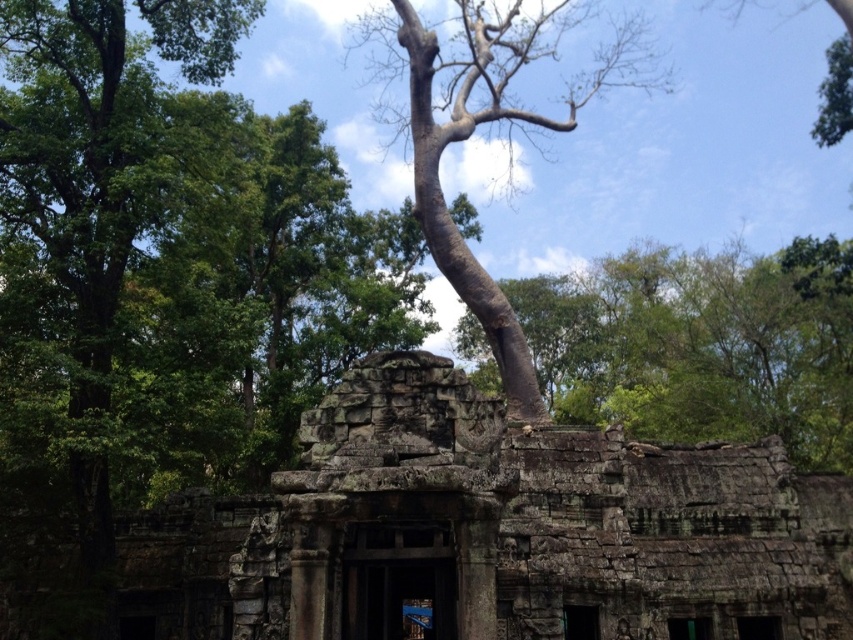
You are an archaeologist examining the ancient site. You notice the weathered stone ruins at center and the bark textured tree at center. Which structure is wider when comparing their widths?

The bark textured tree at center is wider than the weathered stone ruins at center.

You are an archaeologist examining the ancient stone structure. You notice two trees in the scene. Which tree, the brown rough tree trunk at center or the bark textured tree at center, is closer to you?

The brown rough tree trunk at center is closer to you because the bark textured tree at center is positioned behind it.

You are an archaeologist examining the ancient site. You notice the weathered stone ruins at center and the bark textured tree at center. Which structure occupies a larger area in the scene?

The bark textured tree at center occupies a larger area than the weathered stone ruins at center according to the description.